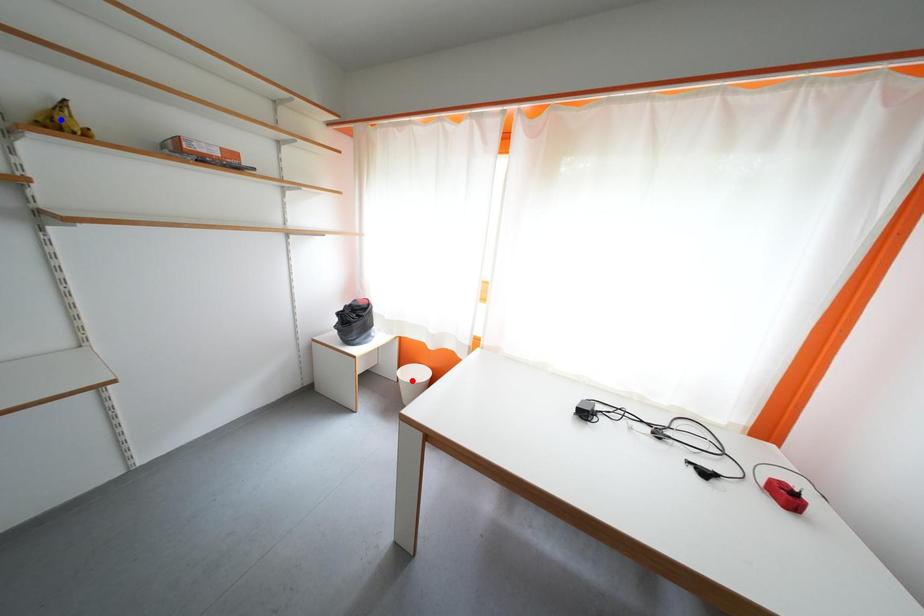
Question: Which of the two points in the image is closer to the camera?

Choices:
 (A) Blue point is closer.
 (B) Red point is closer.

Answer: (A)